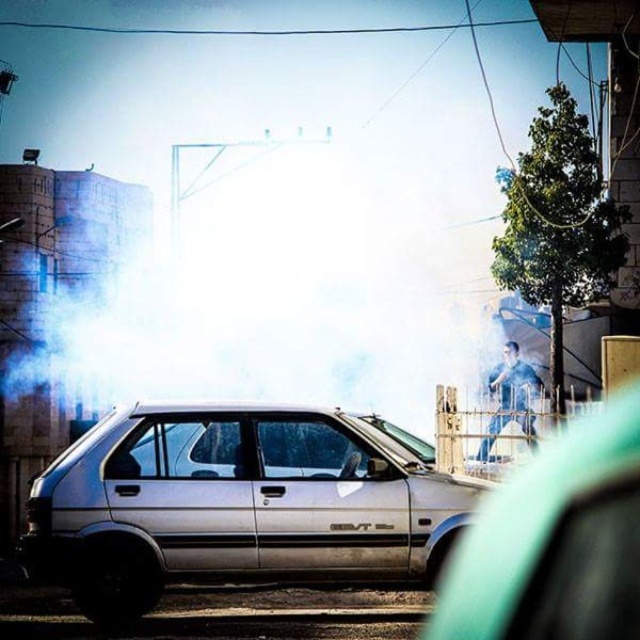
Question: Does white matte hatchback at center appear under blue denim jeans at center?

Choices:
 (A) yes
 (B) no

Answer: (B)

Question: Which point is farther from the camera taking this photo?

Choices:
 (A) (314, 561)
 (B) (515, 401)

Answer: (B)

Question: Which object is the closest to the white foggy smoke at center?

Choices:
 (A) silver metallic hatchback at center
 (B) blue denim jeans at center

Answer: (B)

Question: Is silver metallic hatchback at center smaller than blue denim jeans at center?

Choices:
 (A) no
 (B) yes

Answer: (A)

Question: Does white foggy smoke at center lie in front of white matte hatchback at center?

Choices:
 (A) no
 (B) yes

Answer: (A)

Question: Which point is closer to the camera?

Choices:
 (A) white foggy smoke at center
 (B) blue denim jeans at center
 (C) silver metallic hatchback at center

Answer: (C)